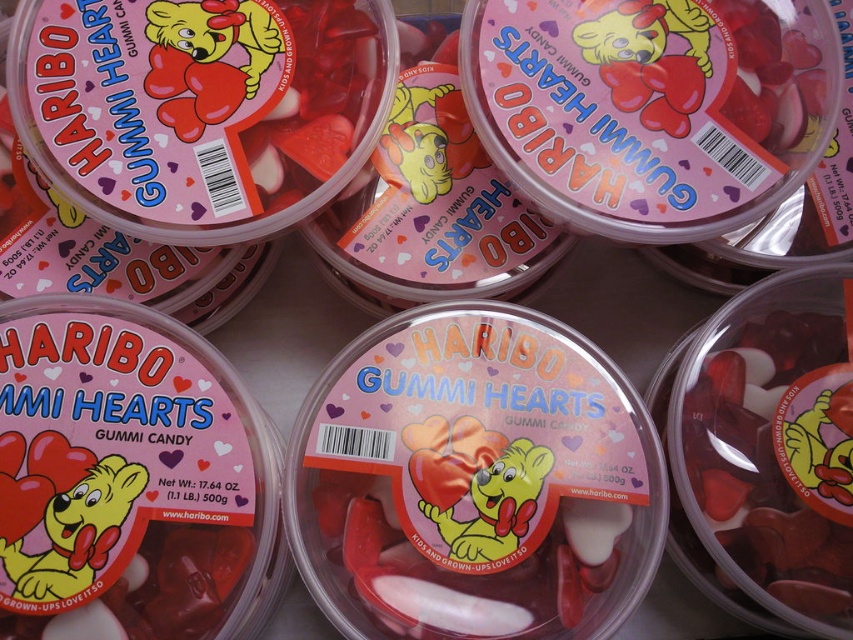
Based on the photo, you are a quality inspector checking the packaging of Haribo Gummy Hearts. You notice a point at coordinates [474,481] in the image. According to the scene description, which object is this point located on?

The point at coordinates [474,481] is located on the matte plastic gummi hearts at center.

You are organizing a candy display and have two containers. The matte plastic container at upper center and the translucent plastic container at center. Which container is wider?

The matte plastic container at upper center is wider than the translucent plastic container at center as its width surpasses the other.

You are looking at the Haribo Gummy Hearts containers and see two points labeled as point (x=477, y=122) and point (x=790, y=365). Which point is closer to you?

Point (x=477, y=122) is closer to the camera than point (x=790, y=365), so it is the point closer to you.